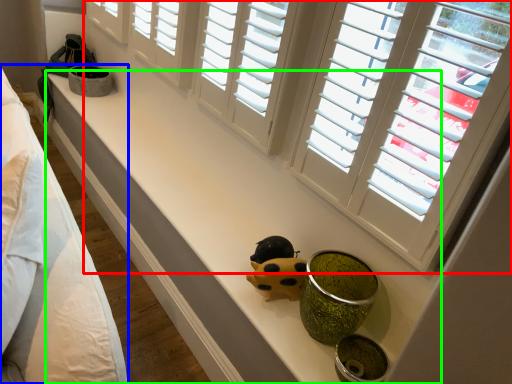
Question: Based on their relative distances, which object is nearer to window (highlighted by a red box)? Choose from bed (highlighted by a blue box) and counter top (highlighted by a green box).

Choices:
 (A) bed
 (B) counter top

Answer: (B)